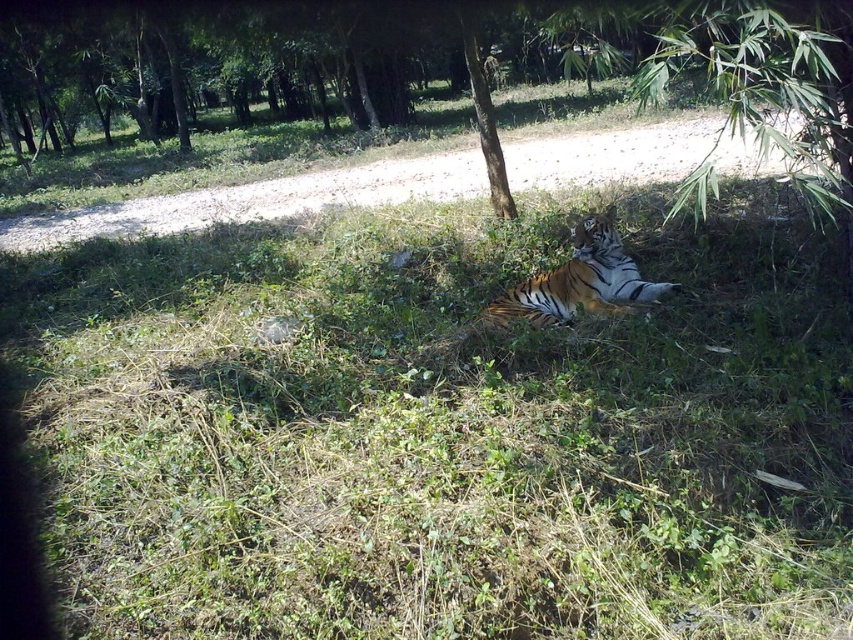
Based on the photo, you are a photographer trying to capture the orange and black striped tiger in the center of the image. The camera you are using has a focus point at coordinate point (579, 282). Will this focus point help you capture the tiger clearly?

Yes, the orange and black striped tiger in the center is represented by point (579, 282), so the focus point is directly on the tiger, ensuring clear capture.

You are a wildlife photographer aiming to capture a close shot of the tiger. You are currently standing at point with coordinates point (x=563, y=282). The minimum focusing distance of your camera is 5 meters. Can you take a clear photo of the tiger from your current position?

The distance of point (x=563, y=282) from camera is 5.15 meters, which is slightly beyond the camera minimum focusing distance of 5 meters. Therefore, you can take a clear photo of the tiger from your current position.